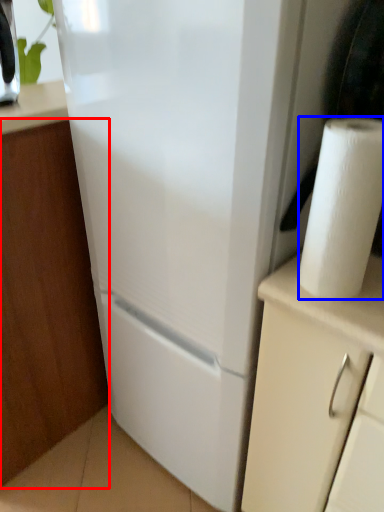
Question: Which object appears farthest to the camera in this image, cabinetry (highlighted by a red box) or paper towel (highlighted by a blue box)?

Choices:
 (A) cabinetry
 (B) paper towel

Answer: (A)